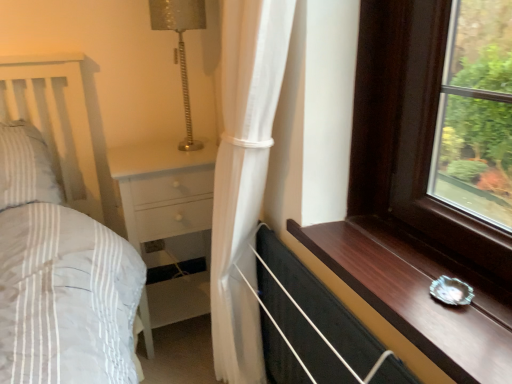
Question: Is dark wood window sill at lower right to the right of white wood chest of drawers at center from the viewer's perspective?

Choices:
 (A) no
 (B) yes

Answer: (B)

Question: From the image's perspective, does dark wood window sill at lower right appear higher than white wood chest of drawers at center?

Choices:
 (A) no
 (B) yes

Answer: (B)

Question: Would you say dark wood window sill at lower right is outside white wood chest of drawers at center?

Choices:
 (A) yes
 (B) no

Answer: (A)

Question: Is dark wood window sill at lower right turned away from white wood chest of drawers at center?

Choices:
 (A) yes
 (B) no

Answer: (B)

Question: From the image's perspective, is dark wood window sill at lower right under white wood chest of drawers at center?

Choices:
 (A) yes
 (B) no

Answer: (B)

Question: From a real-world perspective, is white wood chest of drawers at center above or below white sheer curtain at center?

Choices:
 (A) above
 (B) below

Answer: (B)

Question: From the image's perspective, is white wood chest of drawers at center positioned above or below white sheer curtain at center?

Choices:
 (A) below
 (B) above

Answer: (A)

Question: Is white wood chest of drawers at center bigger or smaller than white sheer curtain at center?

Choices:
 (A) big
 (B) small

Answer: (A)

Question: In the image, is white wood chest of drawers at center on the left side or the right side of white sheer curtain at center?

Choices:
 (A) left
 (B) right

Answer: (A)

Question: Considering the positions of dark wood window sill at lower right and white sheer curtain at center in the image, is dark wood window sill at lower right bigger or smaller than white sheer curtain at center?

Choices:
 (A) small
 (B) big

Answer: (A)

Question: Is dark wood window sill at lower right situated inside white sheer curtain at center or outside?

Choices:
 (A) inside
 (B) outside

Answer: (B)

Question: Based on their positions, is dark wood window sill at lower right located to the left or right of white sheer curtain at center?

Choices:
 (A) left
 (B) right

Answer: (B)

Question: From the image's perspective, is dark wood window sill at lower right located above or below white sheer curtain at center?

Choices:
 (A) below
 (B) above

Answer: (A)

Question: Considering their positions, is white wood chest of drawers at center located in front of or behind metallic silver lamp at upper center?

Choices:
 (A) behind
 (B) front

Answer: (A)

Question: Considering the positions of white wood chest of drawers at center and metallic silver lamp at upper center in the image, is white wood chest of drawers at center bigger or smaller than metallic silver lamp at upper center?

Choices:
 (A) small
 (B) big

Answer: (B)